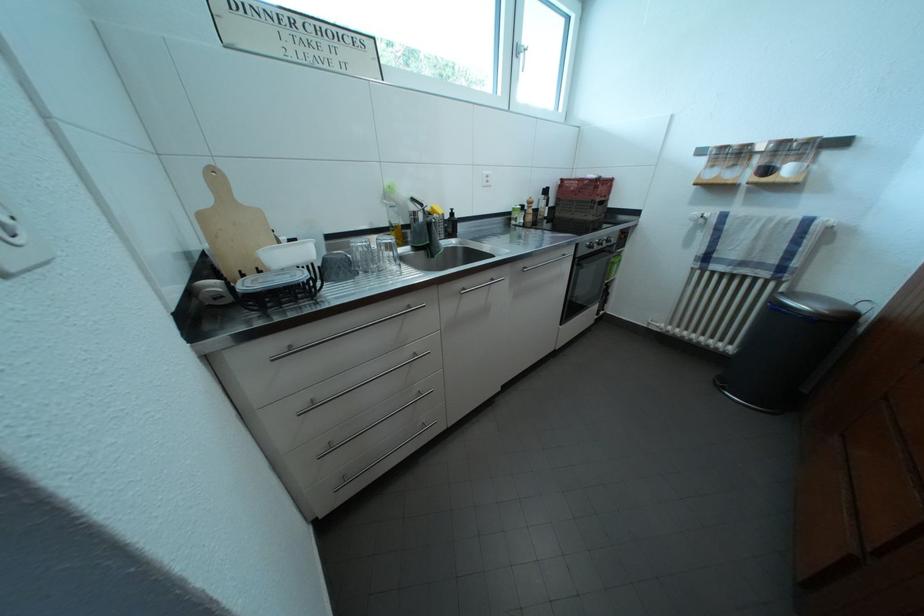
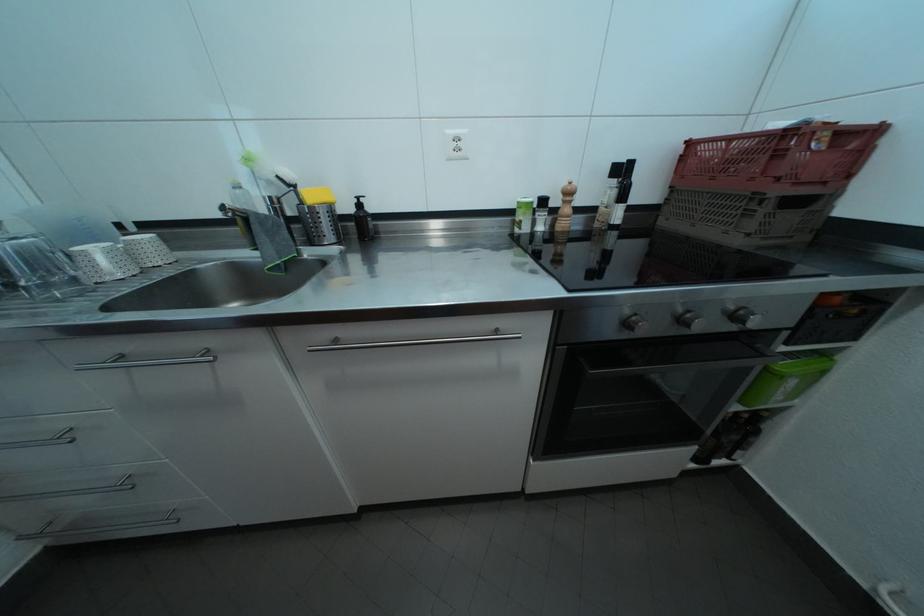
Locate, in the second image, the point that corresponds to (554,198) in the first image.

(630, 176)